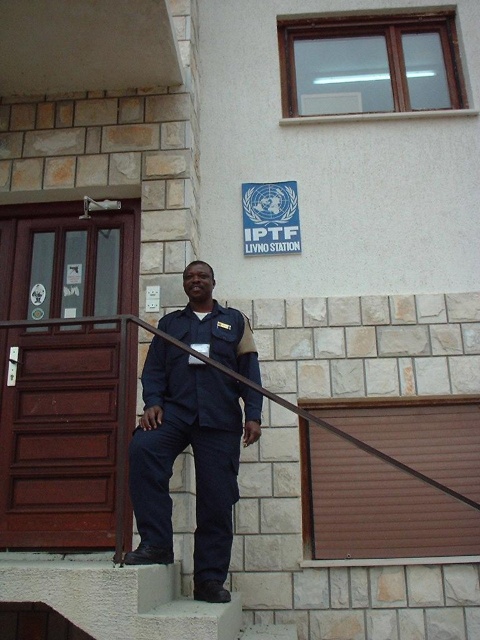
From the picture: Who is shorter, dark blue uniform at center or concrete at center?

Standing shorter between the two is concrete at center.

Does dark blue uniform at center come behind concrete at center?

Yes, it is.

Locate an element on the screen. The height and width of the screenshot is (640, 480). dark blue uniform at center is located at coordinates (193, 460).